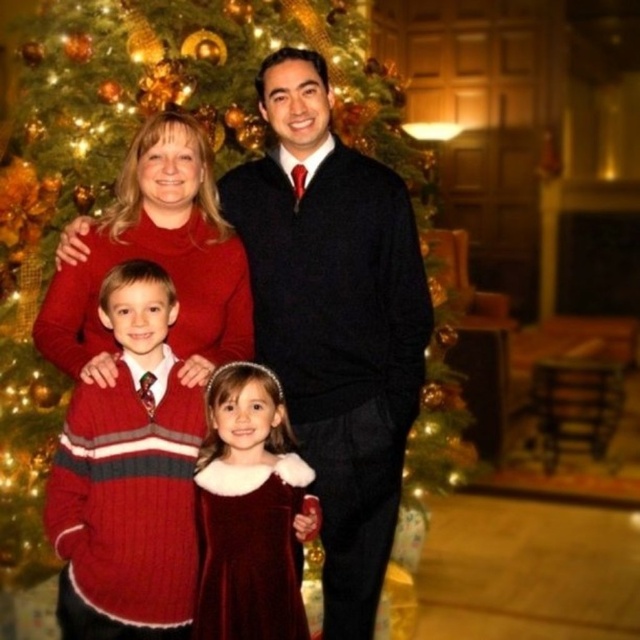
In the Christmas photo, there are two people wearing the matte black sweater at center and the velvet dress at center. Which one is positioned to the right?

The matte black sweater at center is positioned to the right of the velvet dress at center.